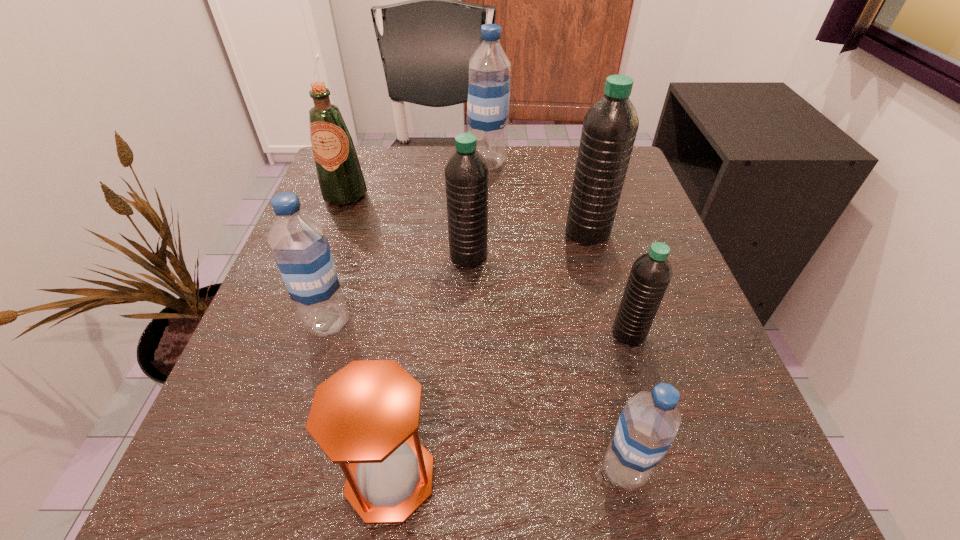
You are a GUI agent. You are given a task and a screenshot of the screen. Output one action in this format:
    pyautogui.click(x=<x>, y=<y>)
    Task: Click on the free space located on the left of the smallest black water bottle
    
    Given the screenshot: What is the action you would take?
    pyautogui.click(x=454, y=334)

Where is `vacant space situated on the label of the smallest blue water bottle`? This screenshot has width=960, height=540. vacant space situated on the label of the smallest blue water bottle is located at coordinates (561, 470).

At what (x,y) coordinates should I click in order to perform the action: click on vacant space situated 0.220m on the label of the smallest blue water bottle. Please return your answer as a coordinate pair (x, y). The width and height of the screenshot is (960, 540). Looking at the image, I should click on (423, 470).

Find the location of a particular element. The height and width of the screenshot is (540, 960). free space located 0.320m on the label of the smallest blue water bottle is located at coordinates (343, 470).

Locate an element on the screen. The width and height of the screenshot is (960, 540). free spot located on the left of the brown hourglass is located at coordinates (291, 477).

Where is `water bottle present at the far edge`? Image resolution: width=960 pixels, height=540 pixels. water bottle present at the far edge is located at coordinates (488, 102).

Locate an element on the screen. The height and width of the screenshot is (540, 960). olive oil at the far edge is located at coordinates (340, 177).

At what (x,y) coordinates should I click in order to perform the action: click on water bottle that is positioned at the near edge. Please return your answer as a coordinate pair (x, y). Looking at the image, I should click on point(648,424).

In order to click on hourglass situated at the near edge in this screenshot , I will do pos(367,414).

You are a GUI agent. You are given a task and a screenshot of the screen. Output one action in this format:
    pyautogui.click(x=<x>, y=<y>)
    Task: Click on the olive oil located at the left edge
    Image resolution: width=960 pixels, height=540 pixels.
    Given the screenshot: What is the action you would take?
    pyautogui.click(x=340, y=177)